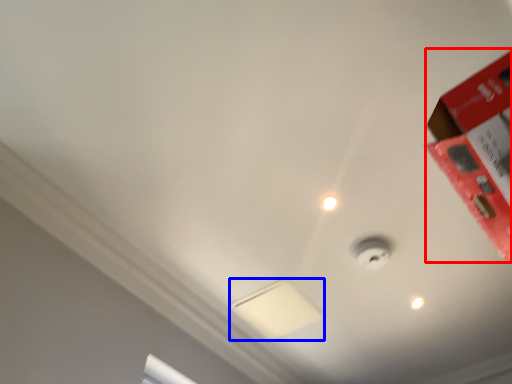
Question: Among these objects, which one is farthest to the camera, box (highlighted by a red box) or lamp (highlighted by a blue box)?

Choices:
 (A) box
 (B) lamp

Answer: (B)